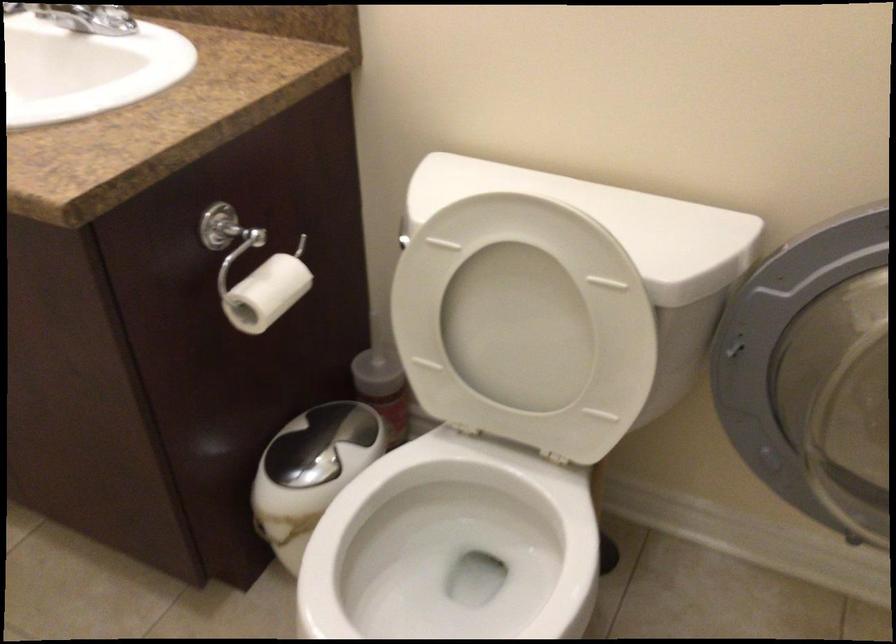
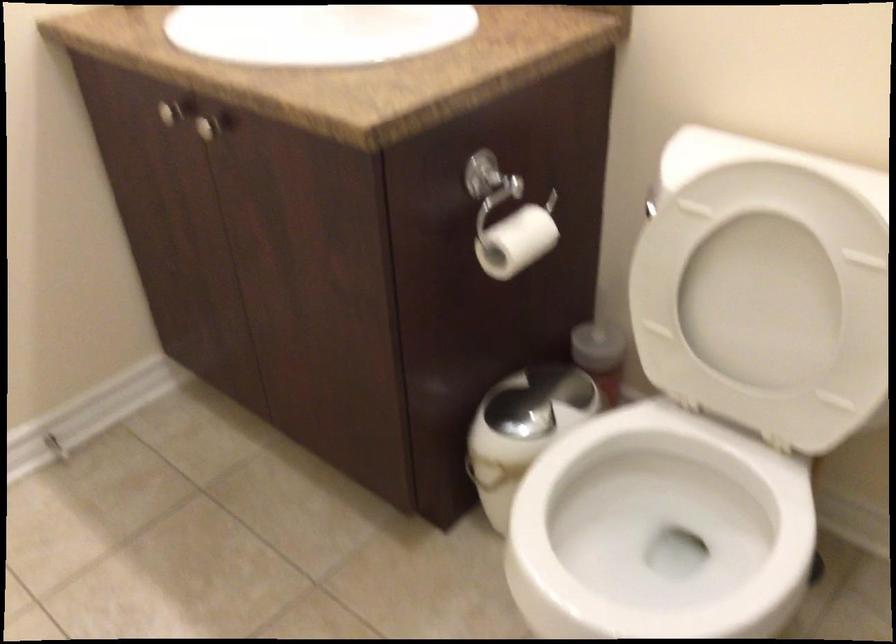
The point at (x=268, y=297) is marked in the first image. Where is the corresponding point in the second image?

(515, 242)